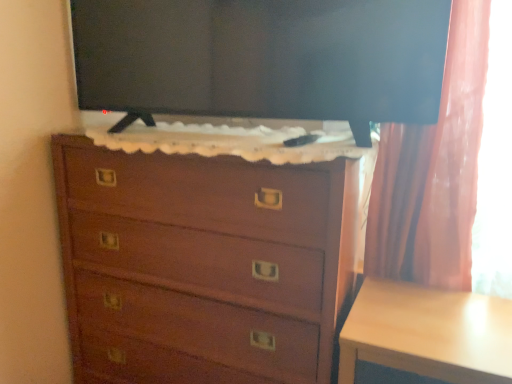
Question: Is point (438, 38) positioned closer to the camera than point (210, 215)?

Choices:
 (A) closer
 (B) farther

Answer: (A)

Question: From the image's perspective, is black glossy tv at upper center located above or below wooden chest of drawers at center?

Choices:
 (A) below
 (B) above

Answer: (B)

Question: Which object is the closest to the wooden chest of drawers at center?

Choices:
 (A) light wood table at lower right
 (B) black glossy tv at upper center

Answer: (A)

Question: Which object is positioned farthest from the wooden chest of drawers at center?

Choices:
 (A) black glossy tv at upper center
 (B) light wood table at lower right

Answer: (A)